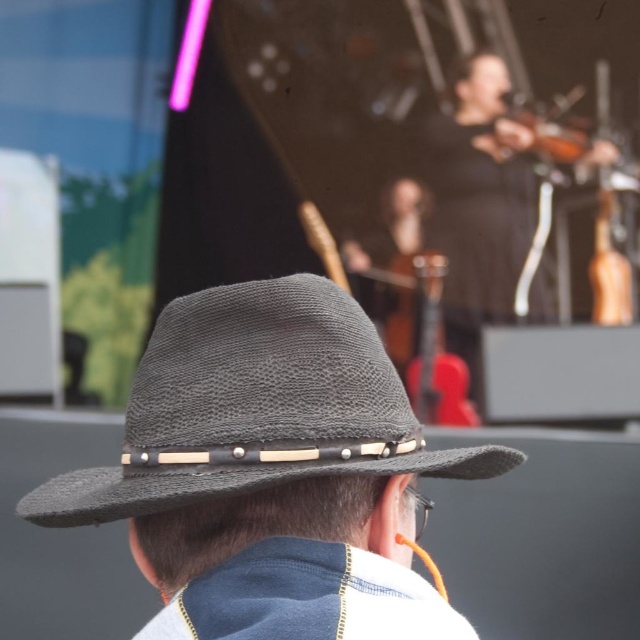
You are a photographer at a live music event. You need to capture a closeup shot of the black woven hat at center and the faded denim jacket at lower right. Which object should you zoom in on to ensure both are in focus without moving the camera? Explain your reasoning based on their sizes.

The black woven hat at center is bigger than the faded denim jacket at lower right. To ensure both are in focus without moving the camera, you should zoom in on the smaller object, which is the faded denim jacket at lower right. This way, the larger black woven hat at center will naturally be within the depth of field when the smaller object is in focus.